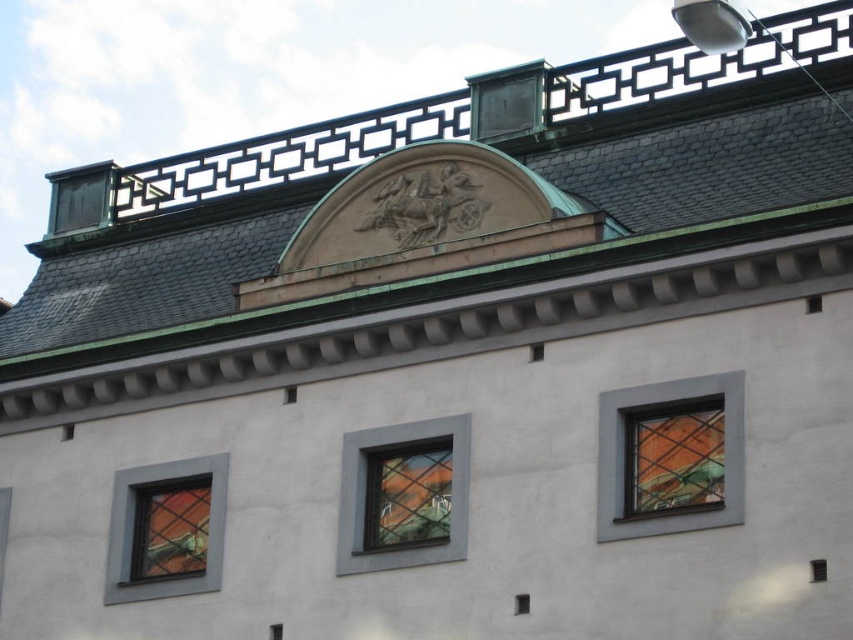
Question: Which of the following is the closest to the observer?

Choices:
 (A) (409, 554)
 (B) (399, 467)
 (C) (115, 586)
 (D) (715, 404)

Answer: (D)

Question: Which of the following is the farthest from the observer?

Choices:
 (A) matte glass window at lower left
 (B) transparent glass window at center
 (C) clear glass window at center

Answer: (A)

Question: Does transparent glass window at center appear on the left side of matte glass window at lower left?

Choices:
 (A) yes
 (B) no

Answer: (B)

Question: Is clear glass window at right wider than clear glass window at center?

Choices:
 (A) yes
 (B) no

Answer: (B)

Question: Does clear glass window at center have a greater width compared to matte glass window at lower left?

Choices:
 (A) yes
 (B) no

Answer: (A)

Question: Among these objects, which one is nearest to the camera?

Choices:
 (A) transparent glass window at center
 (B) clear glass window at right

Answer: (B)